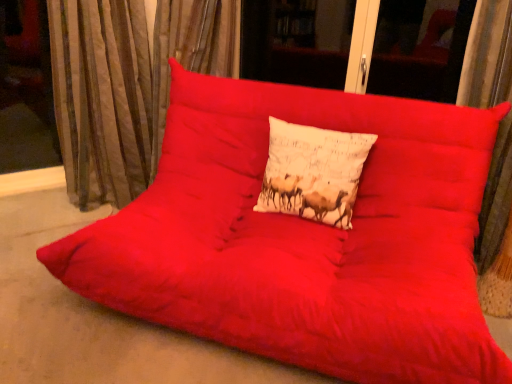
Question: Should I look upward or downward to see white cotton cushion at center?

Choices:
 (A) up
 (B) down

Answer: (A)

Question: From a real-world perspective, is white cotton cushion at center beneath velvet-like brown curtain at left?

Choices:
 (A) no
 (B) yes

Answer: (B)

Question: Is white cotton cushion at center further to camera compared to velvet-like brown curtain at left?

Choices:
 (A) yes
 (B) no

Answer: (B)

Question: Considering the relative sizes of white cotton cushion at center and velvet-like brown curtain at left in the image provided, is white cotton cushion at center bigger than velvet-like brown curtain at left?

Choices:
 (A) yes
 (B) no

Answer: (B)

Question: Considering the relative positions of white cotton cushion at center and velvet-like brown curtain at left in the image provided, is white cotton cushion at center in front of velvet-like brown curtain at left?

Choices:
 (A) yes
 (B) no

Answer: (A)

Question: Is white cotton cushion at center completely or partially outside of velvet-like brown curtain at left?

Choices:
 (A) no
 (B) yes

Answer: (B)

Question: Is white cotton cushion at center at the left side of velvet-like brown curtain at left?

Choices:
 (A) no
 (B) yes

Answer: (A)

Question: Is velvet-like brown curtain at left to the right of white cotton cushion at center from the viewer's perspective?

Choices:
 (A) no
 (B) yes

Answer: (A)

Question: From a real-world perspective, is velvet-like brown curtain at left below white cotton cushion at center?

Choices:
 (A) no
 (B) yes

Answer: (A)

Question: Does velvet-like brown curtain at left appear on the left side of white cotton cushion at center?

Choices:
 (A) no
 (B) yes

Answer: (B)

Question: Considering the relative sizes of velvet-like brown curtain at left and white cotton cushion at center in the image provided, is velvet-like brown curtain at left wider than white cotton cushion at center?

Choices:
 (A) no
 (B) yes

Answer: (B)

Question: Is velvet-like brown curtain at left shorter than white cotton cushion at center?

Choices:
 (A) yes
 (B) no

Answer: (B)

Question: From a real-world perspective, is velvet-like brown curtain at left physically above white cotton cushion at center?

Choices:
 (A) no
 (B) yes

Answer: (B)

Question: Would you say white cotton cushion at center is inside or outside velvet-like brown curtain at left?

Choices:
 (A) outside
 (B) inside

Answer: (A)